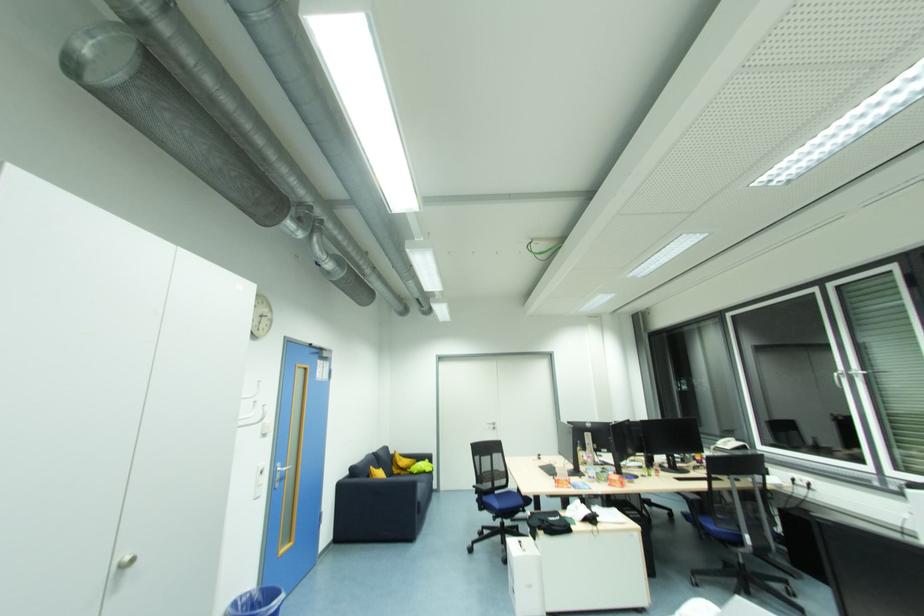
Where is `black chair armrest`? black chair armrest is located at coordinates (492, 490).